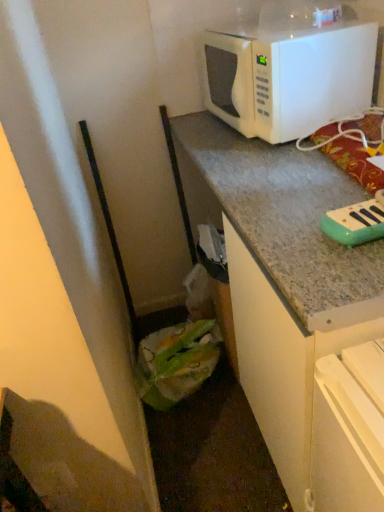
Question: Is green plastic bag at lower left far from white matte microwave at upper right?

Choices:
 (A) no
 (B) yes

Answer: (A)

Question: From a real-world perspective, is green plastic bag at lower left physically above white matte microwave at upper right?

Choices:
 (A) yes
 (B) no

Answer: (B)

Question: Is green plastic bag at lower left not within white matte microwave at upper right?

Choices:
 (A) yes
 (B) no

Answer: (A)

Question: Considering the relative sizes of green plastic bag at lower left and white matte microwave at upper right in the image provided, is green plastic bag at lower left bigger than white matte microwave at upper right?

Choices:
 (A) yes
 (B) no

Answer: (B)

Question: Is green plastic bag at lower left at the right side of white matte microwave at upper right?

Choices:
 (A) yes
 (B) no

Answer: (B)

Question: Is point (284, 96) positioned closer to the camera than point (362, 340)?

Choices:
 (A) closer
 (B) farther

Answer: (B)

Question: Considering the relative positions of white matte microwave at upper right and green plastic bag at lower left in the image provided, is white matte microwave at upper right to the left or to the right of green plastic bag at lower left?

Choices:
 (A) right
 (B) left

Answer: (A)

Question: Is white matte microwave at upper right bigger or smaller than green plastic bag at lower left?

Choices:
 (A) small
 (B) big

Answer: (B)

Question: Is white matte microwave at upper right in front of or behind green plastic bag at lower left in the image?

Choices:
 (A) behind
 (B) front

Answer: (B)

Question: From the image's perspective, is white matte microwave at upper right located above or below teal plastic toy piano at upper right?

Choices:
 (A) above
 (B) below

Answer: (A)

Question: Is white matte microwave at upper right in front of or behind teal plastic toy piano at upper right in the image?

Choices:
 (A) front
 (B) behind

Answer: (B)

Question: In terms of width, does white matte microwave at upper right look wider or thinner when compared to teal plastic toy piano at upper right?

Choices:
 (A) thin
 (B) wide

Answer: (A)

Question: Is white matte microwave at upper right taller or shorter than teal plastic toy piano at upper right?

Choices:
 (A) tall
 (B) short

Answer: (A)

Question: Considering their positions, is teal plastic toy piano at upper right located in front of or behind green plastic bag at lower left?

Choices:
 (A) front
 (B) behind

Answer: (A)

Question: Considering the positions of teal plastic toy piano at upper right and green plastic bag at lower left in the image, is teal plastic toy piano at upper right bigger or smaller than green plastic bag at lower left?

Choices:
 (A) big
 (B) small

Answer: (B)